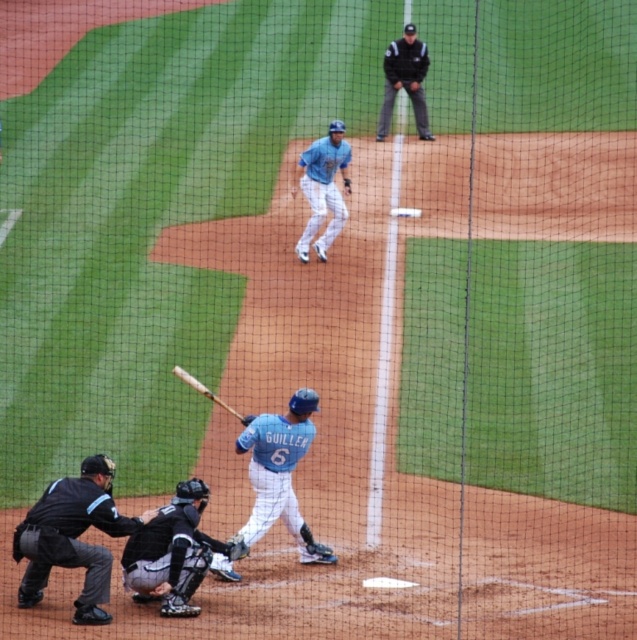
You are standing at the edge of the field and want to throw a ball to the black leather catcher at lower left. The distance between you and the catcher is 11.68 meters. If your throwing range is up to 12 meters, can you reach the catcher?

The distance between you and the black leather catcher at lower left is 11.68 meters, which is within your throwing range of up to 12 meters. Therefore, you can successfully reach the catcher by throwing the ball.

You are a photographer standing behind the protective netting. You want to capture a photo that includes both the black leather catcher at lower left and the dark gray uniform at upper center. Which object should you zoom in on to ensure both fit in the frame?

The black leather catcher at lower left has a lesser width compared to dark gray uniform at upper center, so you should zoom in on the dark gray uniform at upper center to ensure both fit in the frame.

You are a spectator at the baseball game and want to take a photo of both the black leather umpire at lower left and the light blue jersey at upper center in the same frame. Which object should you focus on first to ensure both are in focus?

The black leather umpire at lower left has a lesser height compared to light blue jersey at upper center, so you should focus on the light blue jersey at upper center first to ensure both are in focus.